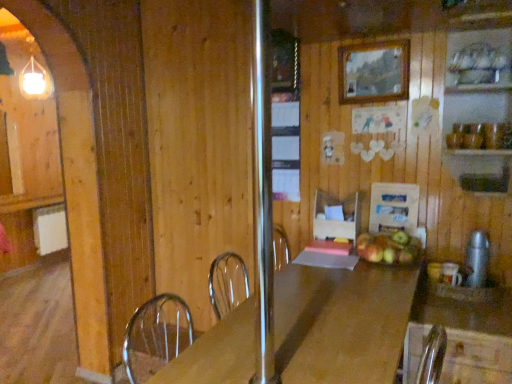
Question: Is satin silver thermos at right, which is the second appliance from left to right, shorter than wooden countertop at right?

Choices:
 (A) yes
 (B) no

Answer: (A)

Question: Is satin silver thermos at right, positioned as the second appliance in back-to-front order, at the right side of wooden countertop at right?

Choices:
 (A) yes
 (B) no

Answer: (A)

Question: Considering the relative sizes of satin silver thermos at right, which is the second appliance from left to right, and wooden countertop at right in the image provided, is satin silver thermos at right, which is the second appliance from left to right, smaller than wooden countertop at right?

Choices:
 (A) yes
 (B) no

Answer: (A)

Question: Does satin silver thermos at right, which is the second appliance from left to right, lie in front of wooden countertop at right?

Choices:
 (A) yes
 (B) no

Answer: (B)

Question: Does satin silver thermos at right, which is the second appliance from left to right, come behind wooden countertop at right?

Choices:
 (A) no
 (B) yes

Answer: (B)

Question: From the image's perspective, is wooden table at center above or below wooden cutting board at center, which ranks as the 2th appliance in front-to-back order?

Choices:
 (A) below
 (B) above

Answer: (A)

Question: Considering the relative positions of wooden table at center and wooden cutting board at center, which ranks as the 2th appliance in front-to-back order, in the image provided, is wooden table at center to the left or to the right of wooden cutting board at center, which ranks as the 2th appliance in front-to-back order,?

Choices:
 (A) right
 (B) left

Answer: (B)

Question: Is wooden table at center inside or outside of wooden cutting board at center, marked as the 2th appliance in a right-to-left arrangement?

Choices:
 (A) outside
 (B) inside

Answer: (A)

Question: Is wooden table at center taller or shorter than wooden cutting board at center, which is counted as the 1th appliance, starting from the left?

Choices:
 (A) short
 (B) tall

Answer: (B)

Question: In the image, is green matte apples at center positioned in front of or behind wooden table at center?

Choices:
 (A) behind
 (B) front

Answer: (A)

Question: Is point (412, 241) closer or farther from the camera than point (372, 372)?

Choices:
 (A) farther
 (B) closer

Answer: (A)

Question: Is green matte apples at center to the left or to the right of wooden table at center in the image?

Choices:
 (A) left
 (B) right

Answer: (B)

Question: From the image's perspective, relative to wooden table at center, is green matte apples at center above or below?

Choices:
 (A) below
 (B) above

Answer: (B)

Question: Would you say wooden table at center is inside or outside wooden countertop at right?

Choices:
 (A) inside
 (B) outside

Answer: (B)

Question: Considering the positions of wooden table at center and wooden countertop at right in the image, is wooden table at center wider or thinner than wooden countertop at right?

Choices:
 (A) wide
 (B) thin

Answer: (A)